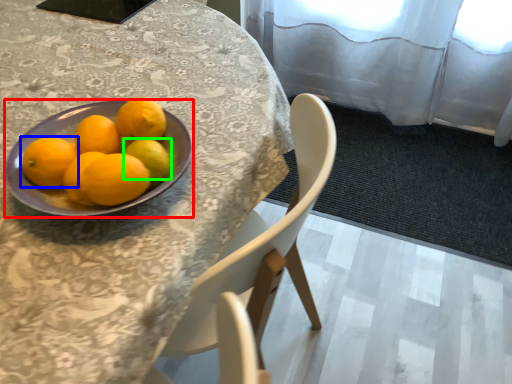
Question: Which object is positioned closest to bowl (highlighted by a red box)? Select from orange (highlighted by a blue box) and lemon (highlighted by a green box).

Choices:
 (A) orange
 (B) lemon

Answer: (A)